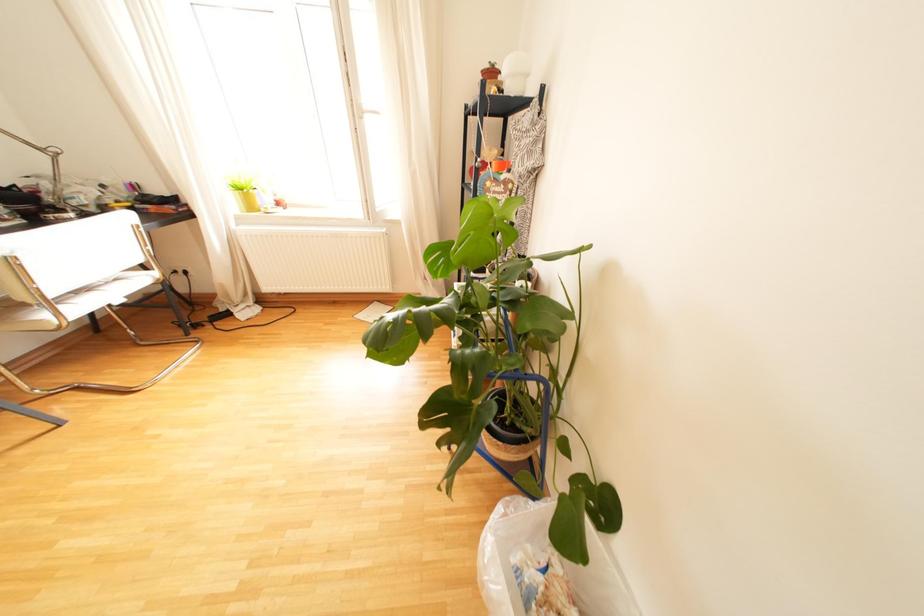
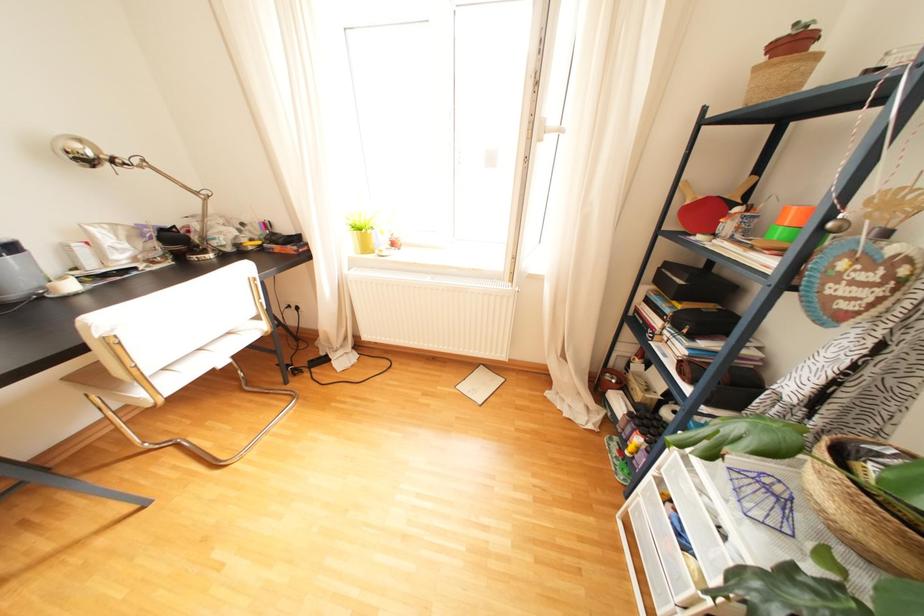
Question: The first image is from the beginning of the video and the second image is from the end. How did the camera likely rotate when shooting the video?

Choices:
 (A) Left
 (B) Right
 (C) Up
 (D) Down

Answer: (A)